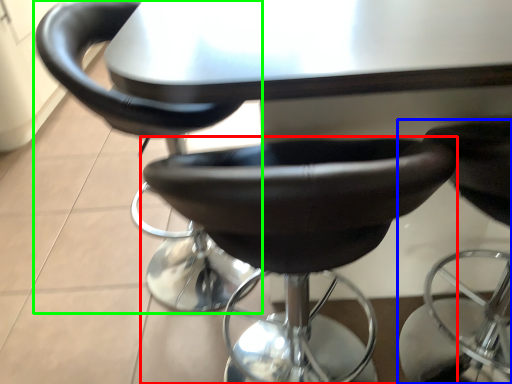
Question: Which object is the closest to the chair (highlighted by a red box)? Choose among these: chair (highlighted by a blue box) or chair (highlighted by a green box).

Choices:
 (A) chair
 (B) chair

Answer: (B)